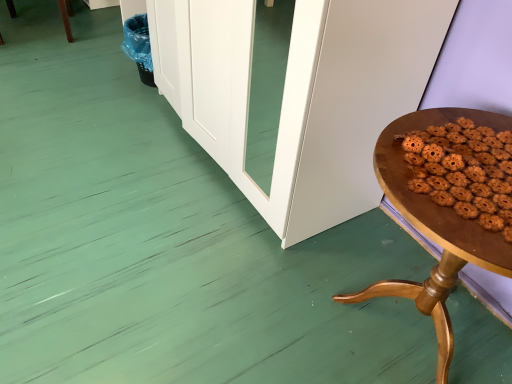
Question: Is wooden table at right taller or shorter than brown matte cookies at right?

Choices:
 (A) tall
 (B) short

Answer: (A)

Question: In terms of width, does wooden table at right look wider or thinner when compared to brown matte cookies at right?

Choices:
 (A) wide
 (B) thin

Answer: (A)

Question: Considering their positions, is wooden table at right located in front of or behind brown matte cookies at right?

Choices:
 (A) front
 (B) behind

Answer: (A)

Question: Visually, is brown matte cookies at right positioned to the left or to the right of wooden table at right?

Choices:
 (A) right
 (B) left

Answer: (B)

Question: Looking at their shapes, would you say brown matte cookies at right is wider or thinner than wooden table at right?

Choices:
 (A) wide
 (B) thin

Answer: (B)

Question: From a real-world perspective, is brown matte cookies at right positioned above or below wooden table at right?

Choices:
 (A) below
 (B) above

Answer: (B)

Question: Considering the positions of brown matte cookies at right and wooden table at right in the image, is brown matte cookies at right taller or shorter than wooden table at right?

Choices:
 (A) tall
 (B) short

Answer: (B)